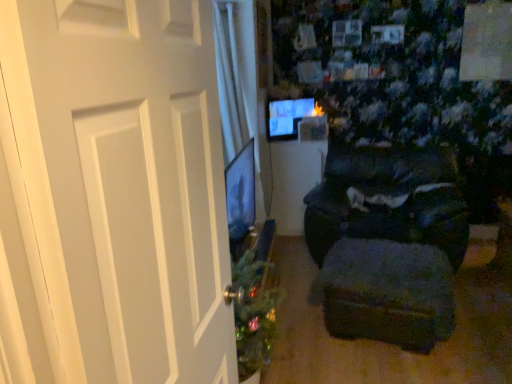
What do you see at coordinates (287, 117) in the screenshot?
I see `matte black monitor at upper center` at bounding box center [287, 117].

Measure the distance between white matte door at left and camera.

white matte door at left is 18.85 inches from camera.

At what (x,y) coordinates should I click in order to perform the action: click on matte black monitor at upper center. Please return your answer as a coordinate pair (x, y). Looking at the image, I should click on [287, 117].

Is dark fabric ottoman at lower right wider or thinner than white matte door at left?

dark fabric ottoman at lower right is wider than white matte door at left.

Considering the sizes of objects dark fabric ottoman at lower right and white matte door at left in the image provided, who is bigger, dark fabric ottoman at lower right or white matte door at left?

Bigger between the two is dark fabric ottoman at lower right.

Looking at this image, which of these two, dark fabric ottoman at lower right or white matte door at left, stands shorter?

dark fabric ottoman at lower right is shorter.

Could you tell me if dark fabric ottoman at lower right is facing white matte door at left?

No, dark fabric ottoman at lower right is not turned towards white matte door at left.

Relative to matte black monitor at upper center, is dark fabric couch at center in front or behind?

dark fabric couch at center is in front of matte black monitor at upper center.

Which point is more forward, (395,196) or (290,109)?

The point (395,196) is in front.

Is dark fabric couch at center looking in the opposite direction of matte black monitor at upper center?

No, dark fabric couch at center's orientation is not away from matte black monitor at upper center.

Consider the image. Considering the sizes of dark fabric couch at center and matte black monitor at upper center in the image, is dark fabric couch at center wider or thinner than matte black monitor at upper center?

Considering their sizes, dark fabric couch at center looks broader than matte black monitor at upper center.

Considering the points (308, 185) and (445, 242), which point is in front, point (308, 185) or point (445, 242)?

Positioned in front is point (445, 242).

Is dark fabric couch at center at the back of matte black table at center?

No.

Is matte black table at center smaller than dark fabric couch at center?

Yes, matte black table at center is smaller than dark fabric couch at center.

Consider the image. Considering the relative sizes of matte black table at center and dark fabric couch at center in the image provided, is matte black table at center thinner than dark fabric couch at center?

Yes.

Which object is positioned more to the left, dark fabric ottoman at lower right or dark fabric couch at center?

dark fabric ottoman at lower right is more to the left.

Is dark fabric ottoman at lower right turned away from dark fabric couch at center?

Yes, dark fabric ottoman at lower right is facing away from dark fabric couch at center.

Looking at this image, how different are the orientations of dark fabric ottoman at lower right and dark fabric couch at center in degrees?

The angular difference between dark fabric ottoman at lower right and dark fabric couch at center is 7.7 degrees.

Is dark fabric ottoman at lower right next to dark fabric couch at center and touching it?

No, dark fabric ottoman at lower right is not making contact with dark fabric couch at center.

In the scene shown: Considering the relative sizes of matte black table at center and dark fabric ottoman at lower right in the image provided, is matte black table at center smaller than dark fabric ottoman at lower right?

Yes, matte black table at center is smaller than dark fabric ottoman at lower right.

Does matte black table at center have a lesser height compared to dark fabric ottoman at lower right?

No.

Is matte black table at center looking in the opposite direction of dark fabric ottoman at lower right?

matte black table at center is not turned away from dark fabric ottoman at lower right.

Would you say matte black table at center is to the left or to the right of dark fabric ottoman at lower right in the picture?

matte black table at center is positioned on dark fabric ottoman at lower right's left side.

Does matte black monitor at upper center touch dark fabric couch at center?

matte black monitor at upper center and dark fabric couch at center are clearly separated.

Is matte black monitor at upper center in front of or behind dark fabric couch at center in the image?

Visually, matte black monitor at upper center is located behind dark fabric couch at center.

Between point (293, 104) and point (456, 250), which one is positioned in front?

The point (456, 250) is in front.

Can you confirm if matte black monitor at upper center is taller than dark fabric couch at center?

No, matte black monitor at upper center is not taller than dark fabric couch at center.

In the scene shown: Is matte black monitor at upper center aimed at dark fabric ottoman at lower right?

No, matte black monitor at upper center does not turn towards dark fabric ottoman at lower right.

Is matte black monitor at upper center inside the boundaries of dark fabric ottoman at lower right, or outside?

Answer: matte black monitor at upper center is not inside dark fabric ottoman at lower right, it's outside.

Can you confirm if matte black monitor at upper center is positioned to the right of dark fabric ottoman at lower right?

Incorrect, matte black monitor at upper center is not on the right side of dark fabric ottoman at lower right.

Find the location of `door lying above the dark fabric ottoman at lower right (from the image's perspective)`. door lying above the dark fabric ottoman at lower right (from the image's perspective) is located at coordinates (124, 183).

There is a dark fabric couch at center. In order to click on computer monitor above it (from a real-world perspective) in this screenshot , I will do `click(287, 117)`.

Based on their spatial positions, is white matte door at left or matte black table at center closer to dark fabric ottoman at lower right?

Among the two, matte black table at center is located nearer to dark fabric ottoman at lower right.

Considering their positions, is white matte door at left positioned further to dark fabric ottoman at lower right than dark fabric couch at center?

white matte door at left is further to dark fabric ottoman at lower right.

Considering their positions, is dark fabric ottoman at lower right positioned closer to dark fabric couch at center than matte black monitor at upper center?

Based on the image, dark fabric ottoman at lower right appears to be nearer to dark fabric couch at center.

Consider the image. When comparing their distances from dark fabric ottoman at lower right, does matte black monitor at upper center or matte black table at center seem further?

matte black monitor at upper center lies further to dark fabric ottoman at lower right than the other object.

Considering their positions, is white matte door at left positioned closer to matte black table at center than matte black monitor at upper center?

The object closer to matte black table at center is matte black monitor at upper center.

Looking at the image, which one is located further to white matte door at left, dark fabric couch at center or dark fabric ottoman at lower right?

dark fabric couch at center lies further to white matte door at left than the other object.

Looking at the image, which one is located further to dark fabric couch at center, matte black monitor at upper center or dark fabric ottoman at lower right?

Based on the image, matte black monitor at upper center appears to be further to dark fabric couch at center.

When comparing their distances from dark fabric ottoman at lower right, does matte black table at center or matte black monitor at upper center seem further?

matte black monitor at upper center.

Locate an element on the screen. Image resolution: width=512 pixels, height=384 pixels. the footrest positioned between white matte door at left and matte black table at center from near to far is located at coordinates (388, 293).

This screenshot has height=384, width=512. Identify the location of table positioned between dark fabric couch at center and matte black monitor at upper center from near to far. (294, 181).

Identify the location of footrest between white matte door at left and dark fabric couch at center along the z-axis. This screenshot has width=512, height=384. (388, 293).

Locate an element on the screen. The image size is (512, 384). furniture located between white matte door at left and matte black monitor at upper center in the depth direction is located at coordinates (388, 200).